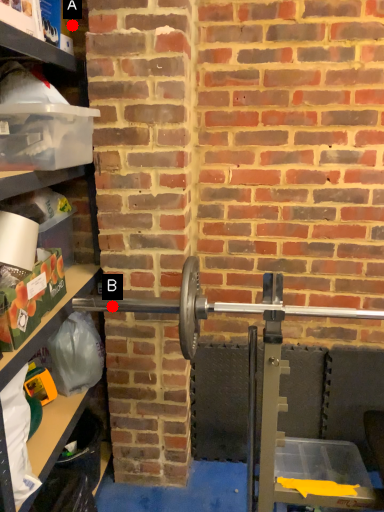
Question: Two points are circled on the image, labeled by A and B beside each circle. Among these points, which one is farthest from the camera?

Choices:
 (A) A is further
 (B) B is further

Answer: (A)